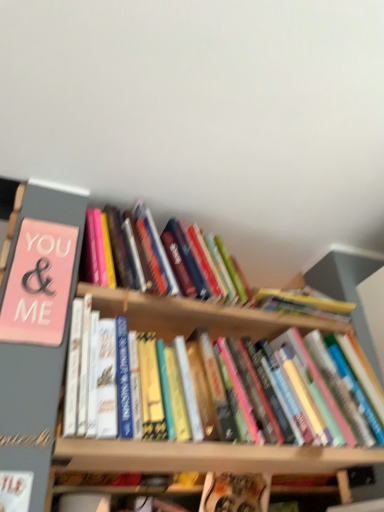
Locate an element on the screen. This screenshot has width=384, height=512. vacant area on top of hardcover book at center, marked as the 1th book in a top-to-bottom arrangement (from a real-world perspective) is located at coordinates (232, 224).